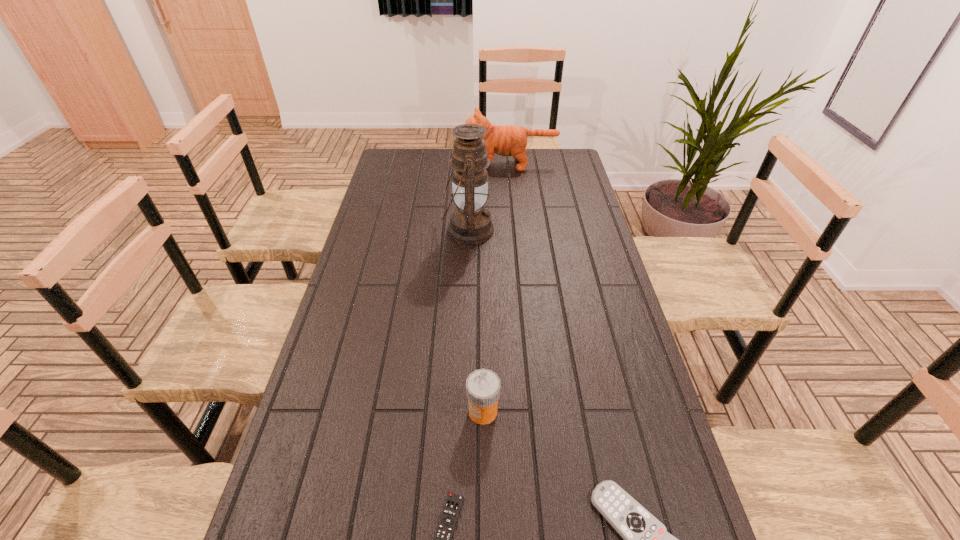
Choose which object is the second nearest neighbor to the third shortest object. Please provide its 2D coordinates. Your answer should be formatted as a tuple, i.e. [(x, y)], where the tuple contains the x and y coordinates of a point satisfying the conditions above.

[(645, 539)]

Select which object is the third closest to the shorter remote control. Please provide its 2D coordinates. Your answer should be formatted as a tuple, i.e. [(x, y)], where the tuple contains the x and y coordinates of a point satisfying the conditions above.

[(470, 223)]

The image size is (960, 540). I want to click on vacant area in the image that satisfies the following two spatial constraints: 1. on the face of the second tallest object; 2. on the front side of the oil lamp, so (517, 230).